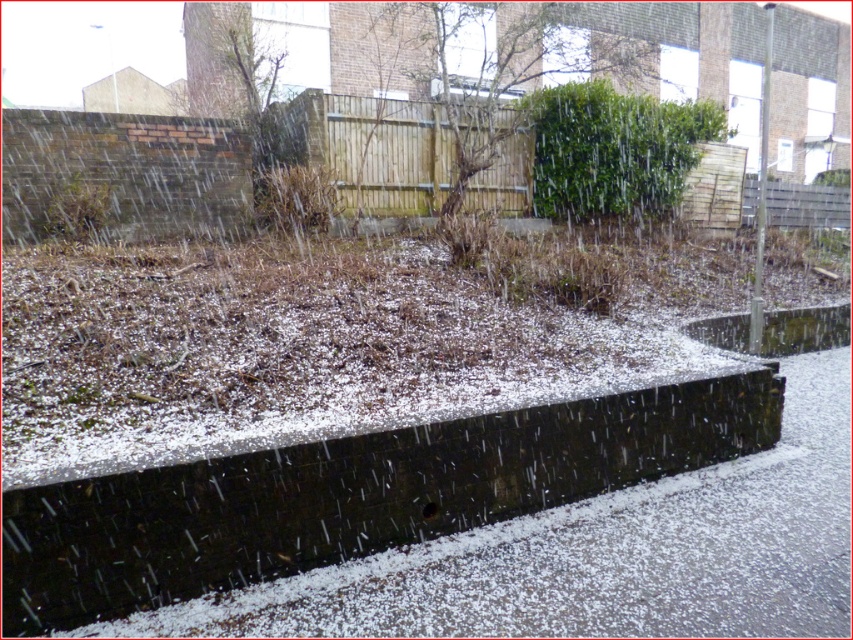
Can you confirm if green leafy tree at upper center is thinner than green leafy bush at upper center?

In fact, green leafy tree at upper center might be wider than green leafy bush at upper center.

Find the location of a particular element. Image resolution: width=853 pixels, height=640 pixels. green leafy tree at upper center is located at coordinates (489, 68).

Find the location of a particular element. This screenshot has width=853, height=640. green leafy tree at upper center is located at coordinates (x=489, y=68).

Which is more to the left, black concrete curb at lower center or green leafy bush at upper center?

Positioned to the left is black concrete curb at lower center.

Does black concrete curb at lower center have a lesser width compared to green leafy bush at upper center?

No.

Between point (303, 486) and point (679, 182), which one is positioned in front?

Point (303, 486) is more forward.

Where is `black concrete curb at lower center`? This screenshot has width=853, height=640. black concrete curb at lower center is located at coordinates (351, 496).

Between black concrete curb at lower center and green leafy tree at upper center, which one has more height?

→ green leafy tree at upper center is taller.

Does black concrete curb at lower center have a smaller size compared to green leafy tree at upper center?

Yes, black concrete curb at lower center is smaller than green leafy tree at upper center.

The image size is (853, 640). I want to click on black concrete curb at lower center, so click(x=351, y=496).

Where is `black concrete curb at lower center`? This screenshot has height=640, width=853. black concrete curb at lower center is located at coordinates coord(351,496).